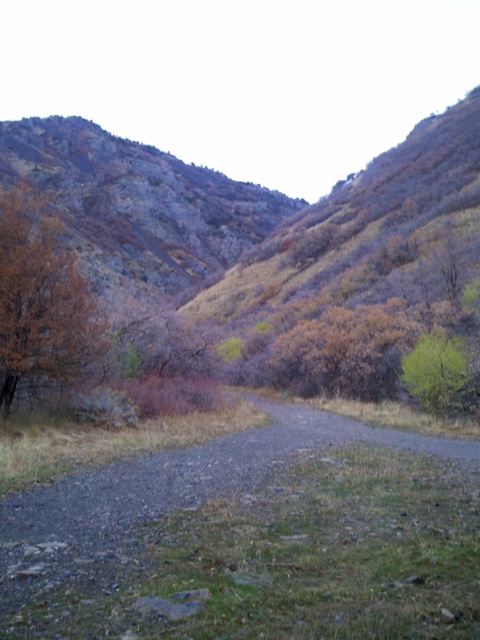
Question: Does orange-brown bark tree at left appear over green leafy tree at center?

Choices:
 (A) no
 (B) yes

Answer: (B)

Question: Which object is positioned farthest from the gray gravel path at center?

Choices:
 (A) green leafy tree at center
 (B) orange-brown bark tree at left

Answer: (A)

Question: Which object is farther from the camera taking this photo?

Choices:
 (A) gray gravel path at center
 (B) orange-brown bark tree at left

Answer: (B)

Question: Can you confirm if gray gravel path at center is smaller than green leafy tree at center?

Choices:
 (A) no
 (B) yes

Answer: (A)

Question: Where is gray gravel path at center located in relation to green leafy tree at center in the image?

Choices:
 (A) left
 (B) right

Answer: (A)

Question: Among these points, which one is nearest to the camera?

Choices:
 (A) (429, 355)
 (B) (32, 349)
 (C) (206, 577)

Answer: (C)